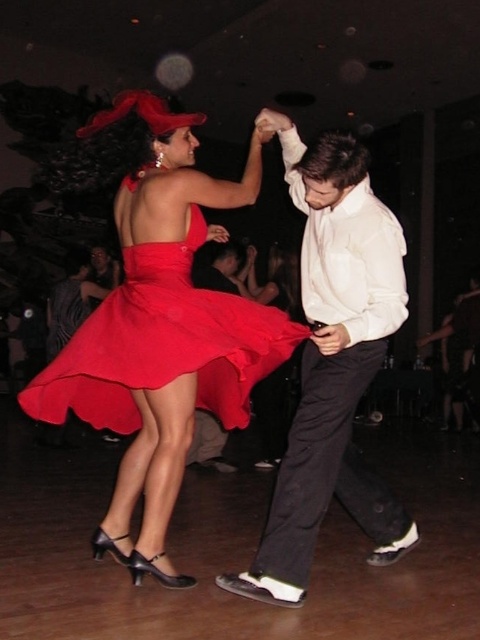
Is matte red dress at center below white smooth shirt at center?

Incorrect, matte red dress at center is not positioned below white smooth shirt at center.

Does point (172, 419) come closer to viewer compared to point (376, 368)?

Yes.

Identify the location of matte red dress at center. (158, 321).

Who is positioned more to the left, matte red dress at center or matte satin dress at center?

matte satin dress at center is more to the left.

Is point (108, 337) more distant than point (131, 365)?

Yes.

Identify the location of matte red dress at center. The height and width of the screenshot is (640, 480). (158, 321).

How much distance is there between white smooth shirt at center and matte satin dress at center?

white smooth shirt at center is 18.05 inches away from matte satin dress at center.

Who is positioned more to the left, white smooth shirt at center or matte satin dress at center?

matte satin dress at center

Does point (262, 592) come farther from viewer compared to point (63, 396)?

No, (262, 592) is closer to viewer.

I want to click on white smooth shirt at center, so click(x=332, y=364).